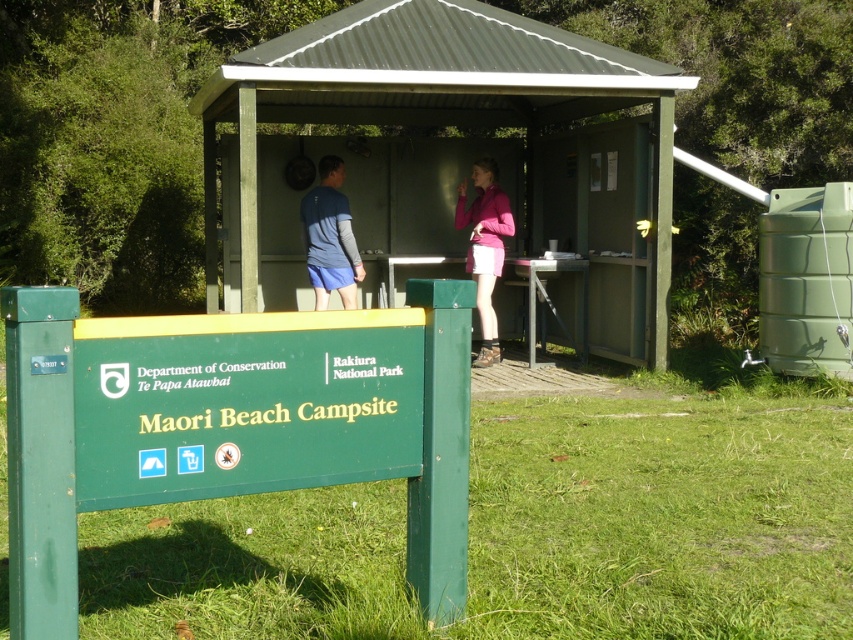
Question: Does green wood hut at center appear under matte pink shirt at center?

Choices:
 (A) yes
 (B) no

Answer: (B)

Question: Which point is farther from the camera taking this photo?

Choices:
 (A) (173, 401)
 (B) (492, 113)
 (C) (490, 328)
 (D) (338, 250)

Answer: (B)

Question: Can you confirm if green wood hut at center is wider than matte blue shirt at center?

Choices:
 (A) no
 (B) yes

Answer: (B)

Question: Which point is closer to the camera?

Choices:
 (A) green wood hut at center
 (B) matte pink shirt at center
 (C) pink matte skirt at center
 (D) green painted wood sign at lower left

Answer: (D)

Question: Which point appears closest to the camera in this image?

Choices:
 (A) (309, 262)
 (B) (271, 61)
 (C) (494, 216)

Answer: (B)

Question: Is green wood hut at center positioned before matte pink shirt at center?

Choices:
 (A) no
 (B) yes

Answer: (B)